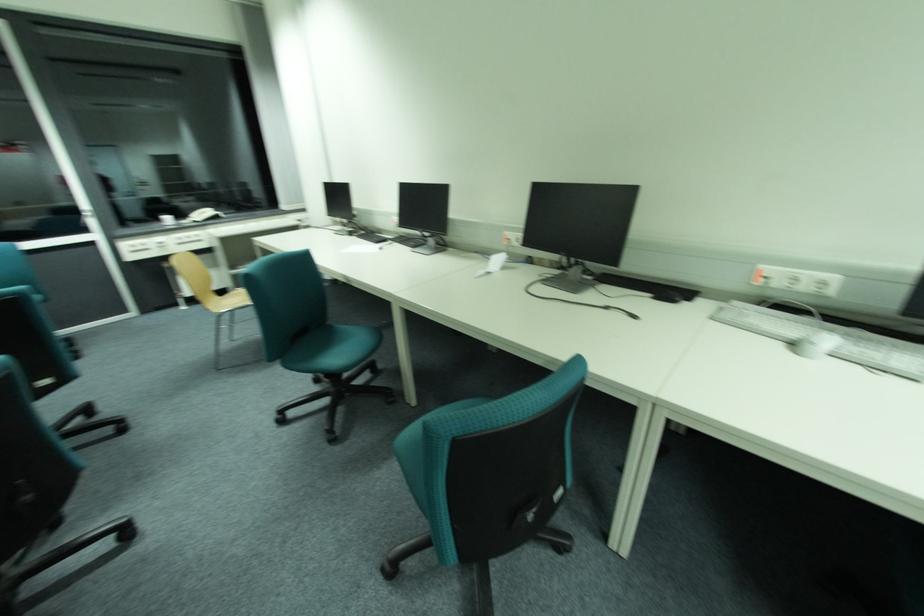
Identify the location of teal chair sitting surface. (332, 349).